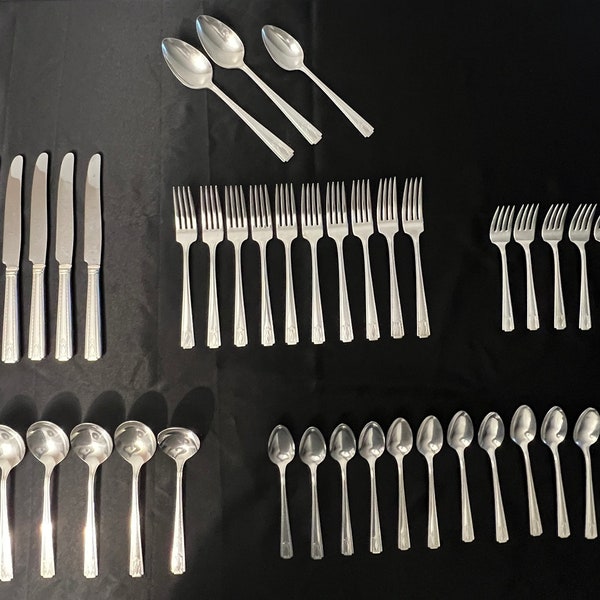
Image resolution: width=600 pixels, height=600 pixels. In order to click on dinner forks in this screenshot , I will do `click(187, 229)`, `click(214, 231)`, `click(234, 229)`, `click(268, 229)`, `click(281, 226)`, `click(312, 228)`, `click(343, 232)`, `click(362, 229)`, `click(388, 225)`, `click(417, 220)`.